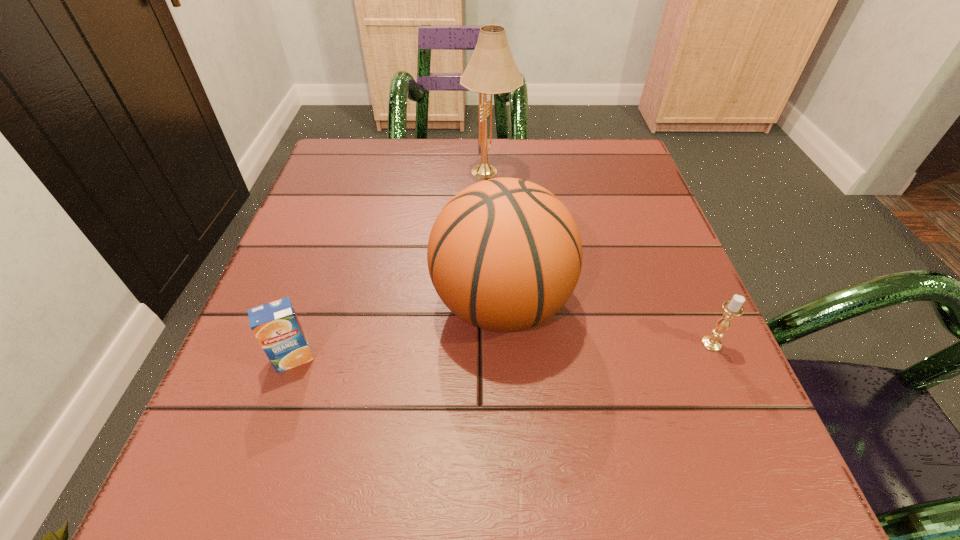
Locate an element on the screen. The image size is (960, 540). lampshade is located at coordinates (492, 70).

You are a GUI agent. You are given a task and a screenshot of the screen. Output one action in this format:
    pyautogui.click(x=<x>, y=<y>)
    Task: Click on the farthest object
    
    Given the screenshot: What is the action you would take?
    coord(492,70)

Locate an element on the screen. the third shortest object is located at coordinates (504, 254).

In order to click on candle holder in this screenshot , I will do (732, 308).

Image resolution: width=960 pixels, height=540 pixels. I want to click on the leftmost object, so click(276, 326).

The width and height of the screenshot is (960, 540). Identify the location of free region located 0.070m on the back of the farthest object. (490, 143).

At what (x,y) coordinates should I click in order to perform the action: click on free space located on the right of the basketball. Please return your answer as a coordinate pair (x, y). Looking at the image, I should click on (605, 303).

You are a GUI agent. You are given a task and a screenshot of the screen. Output one action in this format:
    pyautogui.click(x=<x>, y=<y>)
    Task: Click on the vacant space located 0.360m on the back of the candle holder
    
    Given the screenshot: What is the action you would take?
    pyautogui.click(x=649, y=203)

Locate an element on the screen. This screenshot has width=960, height=540. free space located 0.260m on the back of the orange_juice is located at coordinates (336, 237).

Find the location of a particular element. The width and height of the screenshot is (960, 540). object that is at the far edge is located at coordinates (492, 70).